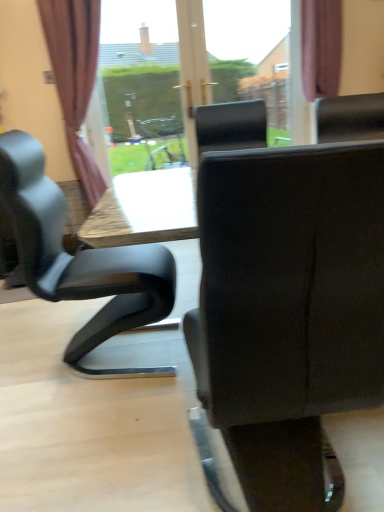
Question: Considering the positions of brown fabric curtain at left, placed as the 2th curtain when sorted from right to left, and purple fabric curtain at upper right, arranged as the 1th curtain when viewed from the right, in the image, is brown fabric curtain at left, placed as the 2th curtain when sorted from right to left, taller or shorter than purple fabric curtain at upper right, arranged as the 1th curtain when viewed from the right,?

Choices:
 (A) tall
 (B) short

Answer: (A)

Question: Does point (74, 19) appear closer or farther from the camera than point (311, 82)?

Choices:
 (A) closer
 (B) farther

Answer: (A)

Question: Which object is positioned farthest from the matte black chair at center?

Choices:
 (A) purple fabric curtain at upper right, arranged as the 1th curtain when viewed from the right
 (B) brown fabric curtain at left, placed as the 2th curtain when sorted from right to left

Answer: (A)

Question: Considering the real-world distances, which object is farthest from the matte black chair at center?

Choices:
 (A) brown fabric curtain at left, placed as the 2th curtain when sorted from right to left
 (B) purple fabric curtain at upper right, arranged as the 1th curtain when viewed from the right

Answer: (B)